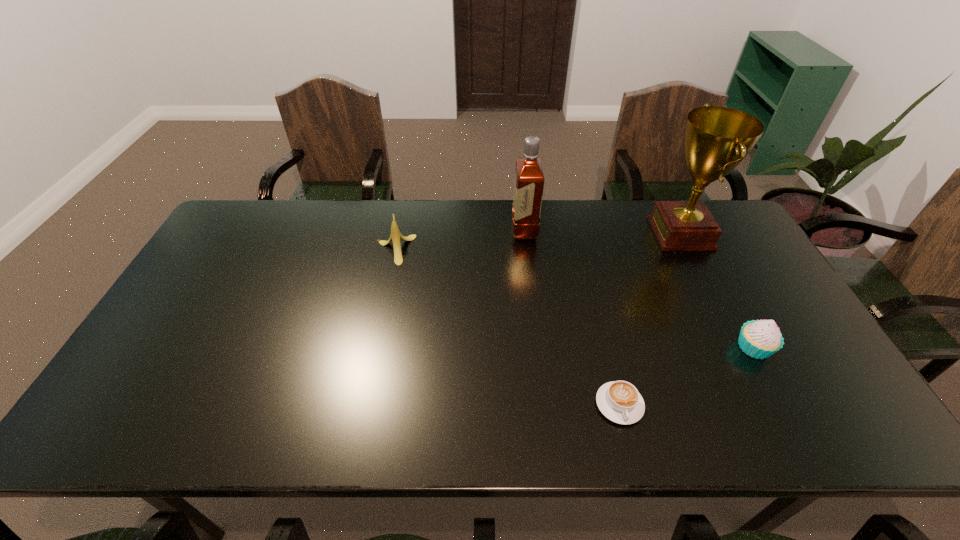
This screenshot has width=960, height=540. Find the location of `the tallest object`. the tallest object is located at coordinates (716, 139).

This screenshot has height=540, width=960. I want to click on the second object from left to right, so click(x=529, y=179).

Identify the location of the fourth shortest object. The image size is (960, 540). (529, 179).

Where is `banana`? The height and width of the screenshot is (540, 960). banana is located at coordinates (396, 236).

Where is `cupcake`? This screenshot has height=540, width=960. cupcake is located at coordinates (759, 339).

Identify the location of the nearest object. (619, 401).

Locate an element on the screen. The height and width of the screenshot is (540, 960). the shortest object is located at coordinates (619, 401).

The image size is (960, 540). I want to click on vacant space located 0.280m on the plaque of the award, so click(567, 233).

This screenshot has width=960, height=540. In order to click on free point located 0.290m on the plaque of the award in this screenshot , I will do `click(564, 233)`.

You are a GUI agent. You are given a task and a screenshot of the screen. Output one action in this format:
    pyautogui.click(x=<x>, y=<y>)
    Task: Click on the vacant space located on the plaque of the award
    The width and height of the screenshot is (960, 540).
    Given the screenshot: What is the action you would take?
    tap(588, 233)